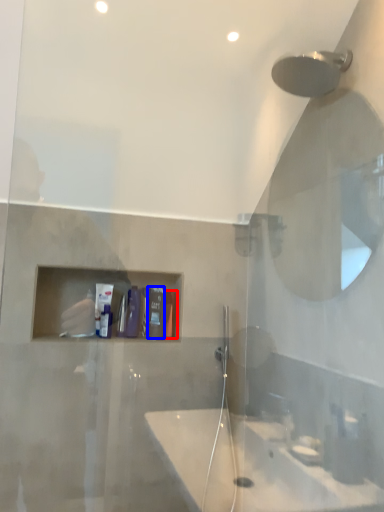
Question: Which point is further to the camera, toiletry (highlighted by a red box) or toiletry (highlighted by a blue box)?

Choices:
 (A) toiletry
 (B) toiletry

Answer: (A)